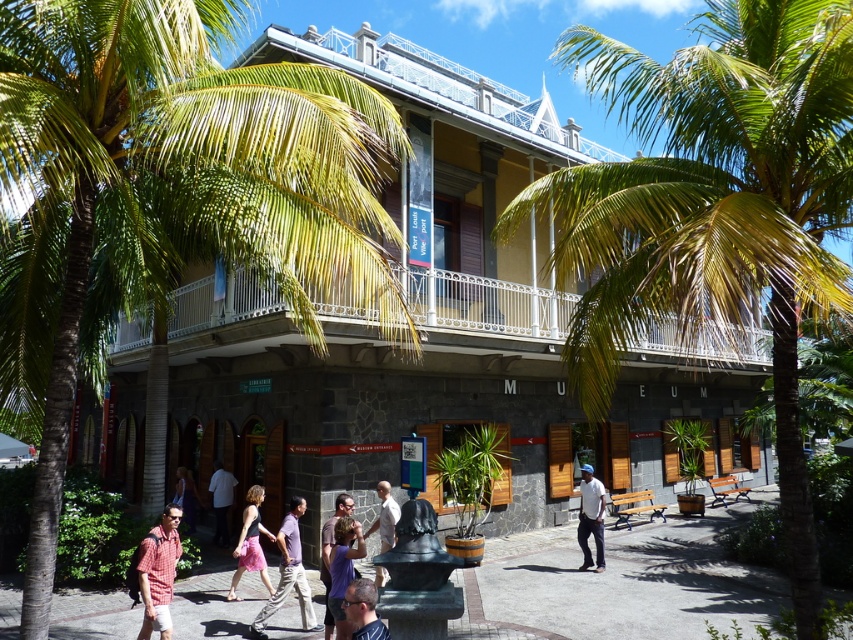
Is green leafy palm tree at upper left to the right of matte white shirt at center from the viewer's perspective?

Correct, you'll find green leafy palm tree at upper left to the right of matte white shirt at center.

Is point (323, 252) less distant than point (189, 522)?

Yes, it is in front of point (189, 522).

This screenshot has height=640, width=853. Find the location of `green leafy palm tree at upper left`. green leafy palm tree at upper left is located at coordinates (165, 196).

From the picture: Is dark gray stone building at center closer to the viewer compared to white shirt at center?

Yes, dark gray stone building at center is closer to the viewer.

Is dark gray stone building at center below white shirt at center?

No.

Locate an element on the screen. The width and height of the screenshot is (853, 640). dark gray stone building at center is located at coordinates (439, 317).

Is green leafy palm tree at center thinner than matte black hair at center?

No.

What do you see at coordinates (715, 209) in the screenshot?
I see `green leafy palm tree at center` at bounding box center [715, 209].

Image resolution: width=853 pixels, height=640 pixels. Identify the location of green leafy palm tree at center. click(715, 209).